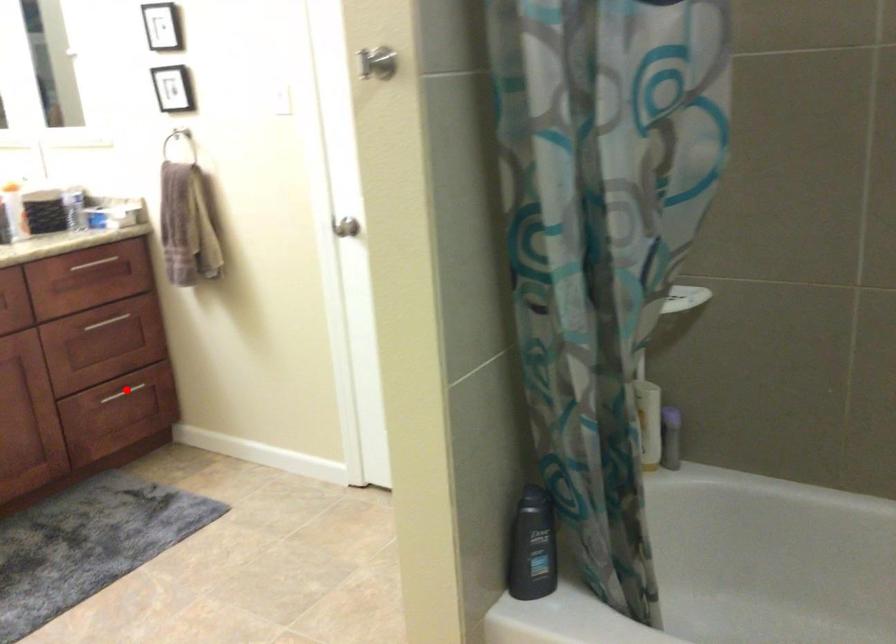
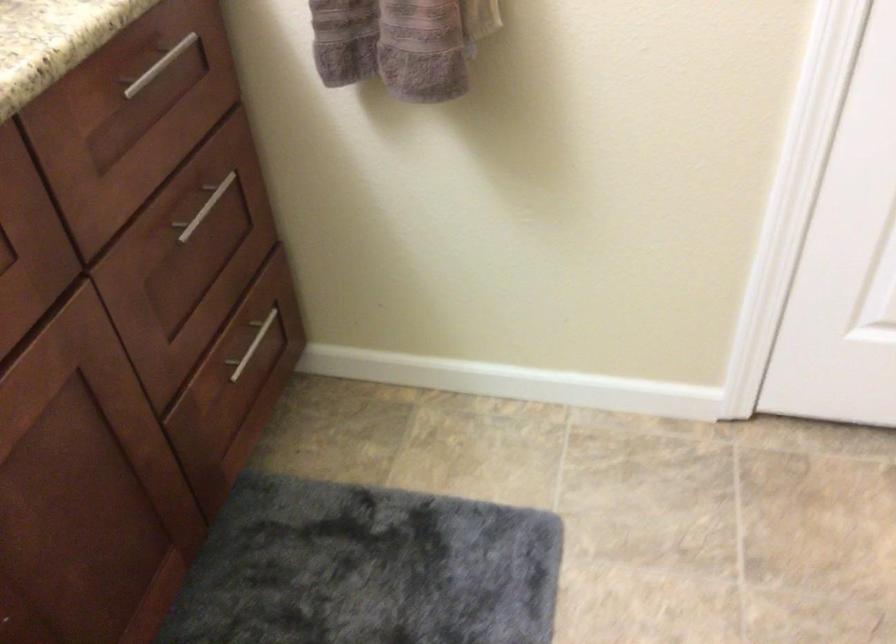
Question: A red point is marked in image1. In image2, is the corresponding 3D point closer to the camera or farther? Reply with the corresponding letter.

Choices:
 (A) The corresponding 3D point is closer.
 (B) The corresponding 3D point is farther.

Answer: (A)